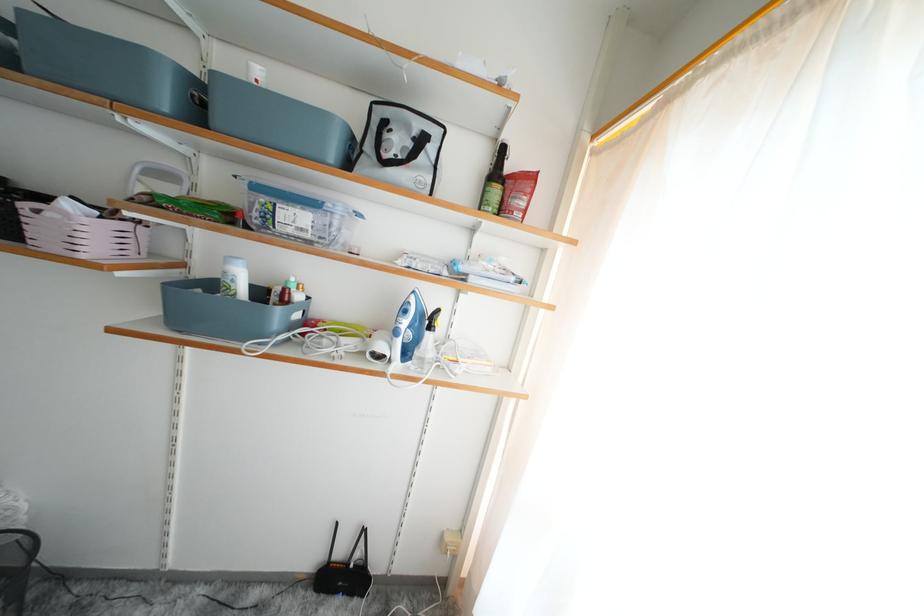
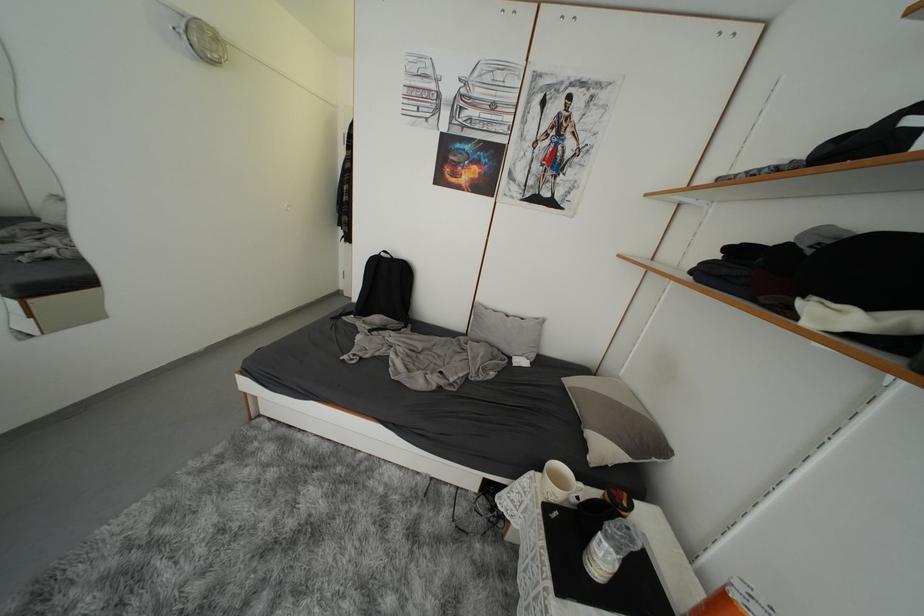
Question: The images are taken continuously from a first-person perspective. In which direction is your viewpoint rotating?

Choices:
 (A) Left
 (B) Right
 (C) Up
 (D) Down

Answer: (A)